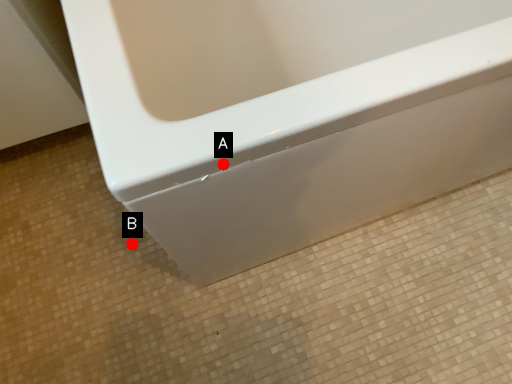
Question: Two points are circled on the image, labeled by A and B beside each circle. Which point is further to the camera?

Choices:
 (A) A is further
 (B) B is further

Answer: (B)